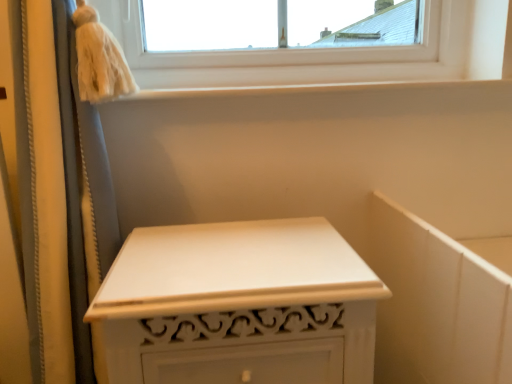
Question: Is white painted wood nightstand at center bigger than white smooth window sill at upper center?

Choices:
 (A) yes
 (B) no

Answer: (A)

Question: Does white painted wood nightstand at center have a lesser width compared to white smooth window sill at upper center?

Choices:
 (A) yes
 (B) no

Answer: (B)

Question: Can you confirm if white painted wood nightstand at center is smaller than white smooth window sill at upper center?

Choices:
 (A) no
 (B) yes

Answer: (A)

Question: Considering the relative sizes of white painted wood nightstand at center and white smooth window sill at upper center in the image provided, is white painted wood nightstand at center wider than white smooth window sill at upper center?

Choices:
 (A) yes
 (B) no

Answer: (A)

Question: Could white smooth window sill at upper center be considered to be inside white painted wood nightstand at center?

Choices:
 (A) no
 (B) yes

Answer: (A)

Question: Is white painted wood nightstand at center located outside white smooth window sill at upper center?

Choices:
 (A) yes
 (B) no

Answer: (A)

Question: From a real-world perspective, is white smooth window sill at upper center located higher than white painted wood nightstand at center?

Choices:
 (A) no
 (B) yes

Answer: (B)

Question: Is white painted wood nightstand at center completely or partially inside white smooth window sill at upper center?

Choices:
 (A) yes
 (B) no

Answer: (B)

Question: Does white smooth window sill at upper center come behind white painted wood nightstand at center?

Choices:
 (A) yes
 (B) no

Answer: (A)

Question: Can you confirm if white smooth window sill at upper center is smaller than white painted wood nightstand at center?

Choices:
 (A) no
 (B) yes

Answer: (B)

Question: Is the position of white smooth window sill at upper center less distant than that of white painted wood nightstand at center?

Choices:
 (A) yes
 (B) no

Answer: (B)

Question: Considering the relative positions of white smooth window sill at upper center and white painted wood nightstand at center in the image provided, is white smooth window sill at upper center to the right of white painted wood nightstand at center from the viewer's perspective?

Choices:
 (A) no
 (B) yes

Answer: (B)

Question: Relative to white painted wood nightstand at center, is white smooth window sill at upper center in front or behind?

Choices:
 (A) behind
 (B) front

Answer: (A)